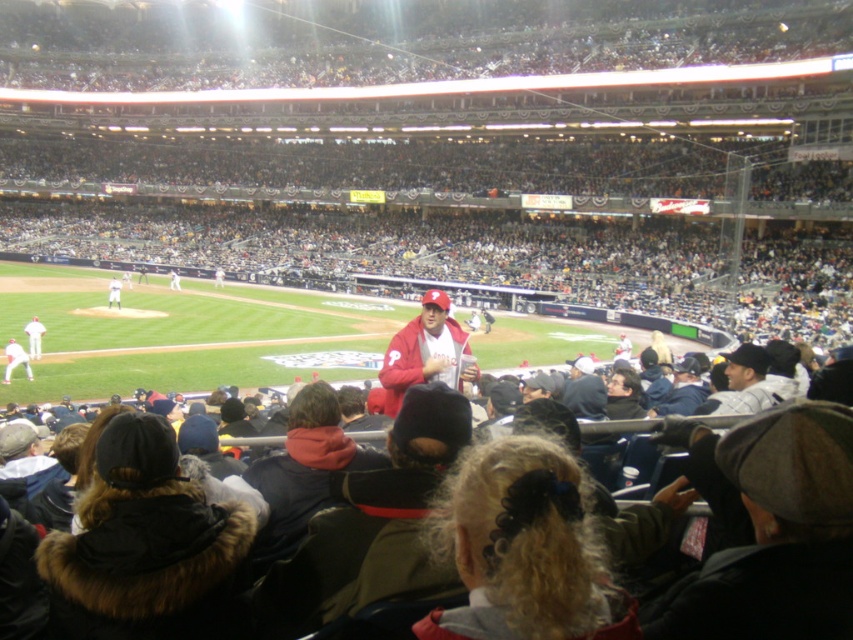
Looking at this image, you are a photographer positioned at the center of the baseball stadium. You want to take a photo that includes both the white jersey at right and the white jersey at left. The camera you are using has a maximum zoom range of 50 meters. Can you capture both jerseys in a single photo without moving your position?

The white jersey at right is 41.87 meters from the white jersey at left. Since the distance between them is within the camera maximum zoom range of 50 meters, you can capture both jerseys in a single photo without moving your position.

You are standing at the entrance of the baseball stadium and see the image. There is a point marked at coordinates (426, 353). Which object from the list is located exactly at that point?

The matte red jacket at center is located exactly at point (426, 353).